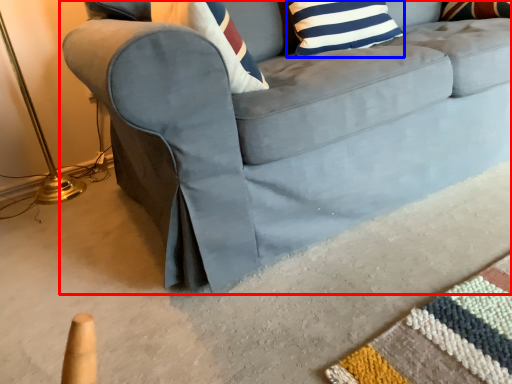
Question: Which of the following is the closest to the observer, studio couch (highlighted by a red box) or pillow (highlighted by a blue box)?

Choices:
 (A) studio couch
 (B) pillow

Answer: (A)